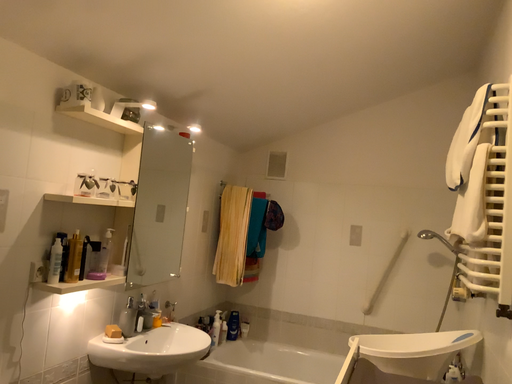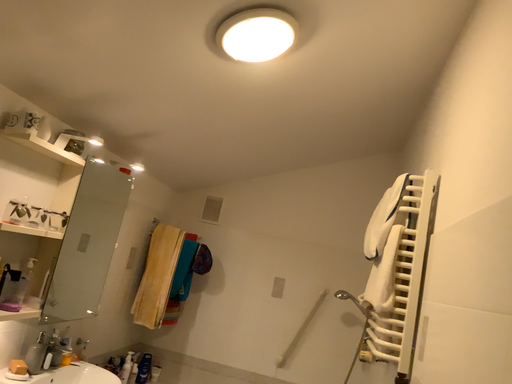
Question: How did the camera likely rotate when shooting the video?

Choices:
 (A) rotated right
 (B) rotated left

Answer: (A)